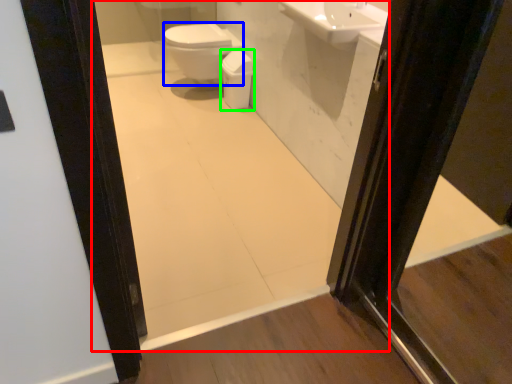
Question: Based on their relative distances, which object is farther from mirror (highlighted by a red box)? Choose from bidet (highlighted by a blue box) and toilet bowl (highlighted by a green box).

Choices:
 (A) bidet
 (B) toilet bowl

Answer: (A)